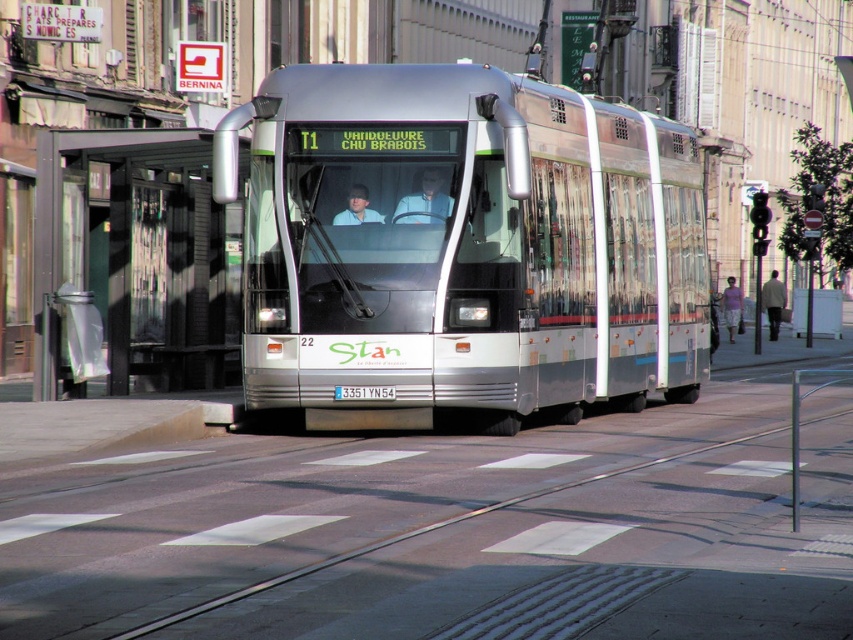
Question: Does metallic track at center appear on the left side of black metal bus stop at center?

Choices:
 (A) yes
 (B) no

Answer: (B)

Question: In this image, where is metallic track at center located relative to light gray metallic coach at right?

Choices:
 (A) right
 (B) left

Answer: (B)

Question: Is metallic track at center above black metal bus stop at center?

Choices:
 (A) yes
 (B) no

Answer: (B)

Question: Which point is closer to the camera taking this photo?

Choices:
 (A) (767, 282)
 (B) (776, 476)
 (C) (125, 324)

Answer: (B)

Question: Which of these objects is positioned farthest from the metallic track at center?

Choices:
 (A) black metal bus stop at center
 (B) silver metallic tram at center

Answer: (A)

Question: Which object is positioned closest to the silver metallic tram at center?

Choices:
 (A) metallic track at center
 (B) light gray metallic coach at right

Answer: (A)